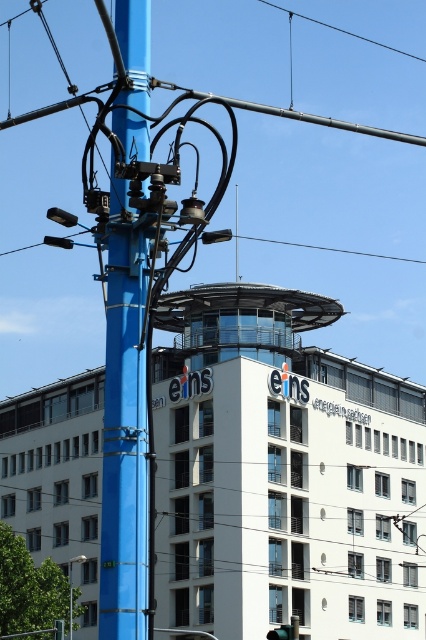
Who is taller, blue painted metal pole at center or green matte traffic light at center?

blue painted metal pole at center

Between point (126, 570) and point (291, 637), which one is positioned behind?

The point (291, 637) is more distant.

You are a GUI agent. You are given a task and a screenshot of the screen. Output one action in this format:
    pyautogui.click(x=<x>, y=<y>)
    Task: Click on the blue painted metal pole at center
    The width and height of the screenshot is (426, 640).
    Given the screenshot: What is the action you would take?
    pyautogui.click(x=124, y=422)

Where is `blue painted metal pole at center`? The height and width of the screenshot is (640, 426). blue painted metal pole at center is located at coordinates (124, 422).

Does blue metallic pole at lower left have a greater width compared to green matte traffic light at center?

Indeed, blue metallic pole at lower left has a greater width compared to green matte traffic light at center.

Is blue metallic pole at lower left to the left of green matte traffic light at center from the viewer's perspective?

Indeed, blue metallic pole at lower left is positioned on the left side of green matte traffic light at center.

Image resolution: width=426 pixels, height=640 pixels. Find the location of `blue metallic pole at lower left`. blue metallic pole at lower left is located at coordinates (71, 588).

Find the location of a particular element. blue metallic pole at lower left is located at coordinates (71, 588).

Is point (126, 196) farther from viewer compared to point (69, 605)?

No, (126, 196) is closer to viewer.

How distant is blue painted metal pole at center from blue metallic pole at lower left?

The distance of blue painted metal pole at center from blue metallic pole at lower left is 54.86 meters.

Locate an element on the screen. blue painted metal pole at center is located at coordinates (124, 422).